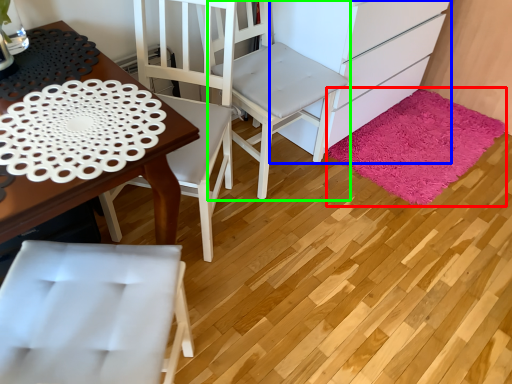
Question: Based on their relative distances, which object is nearer to mat (highlighted by a red box)? Choose from cabinetry (highlighted by a blue box) and chair (highlighted by a green box).

Choices:
 (A) cabinetry
 (B) chair

Answer: (A)